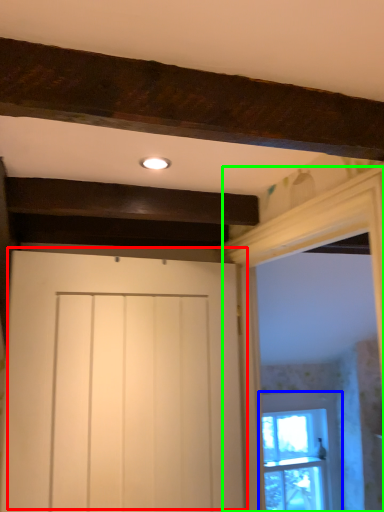
Question: Estimate the real-world distances between objects in this image. Which object is farther from door (highlighted by a red box), window (highlighted by a blue box) or window frame (highlighted by a green box)?

Choices:
 (A) window
 (B) window frame

Answer: (A)